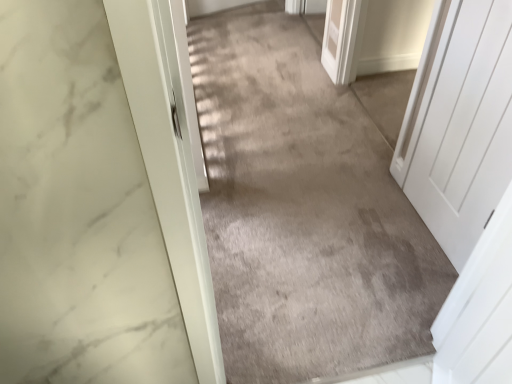
What are the coordinates of `gray carpet at center` in the screenshot? It's located at (306, 205).

What do you see at coordinates (306, 205) in the screenshot? This screenshot has width=512, height=384. I see `gray carpet at center` at bounding box center [306, 205].

What do you see at coordinates (465, 127) in the screenshot?
I see `white matte door at right` at bounding box center [465, 127].

This screenshot has width=512, height=384. I want to click on white matte door at right, so click(x=465, y=127).

This screenshot has width=512, height=384. Identify the location of gray carpet at center. (306, 205).

Is gray carpet at center to the right of white matte door at right from the viewer's perspective?

In fact, gray carpet at center is to the left of white matte door at right.

Is the position of gray carpet at center more distant than that of white matte door at right?

Yes, gray carpet at center is behind white matte door at right.

Does point (197, 74) come farther from viewer compared to point (487, 43)?

Yes, it is behind point (487, 43).

Consider the image. From the image's perspective, which one is positioned lower, gray carpet at center or white matte door at right?

white matte door at right.

From a real-world perspective, is gray carpet at center above or below white matte door at right?

From a real-world perspective, gray carpet at center is physically below white matte door at right.

Considering the sizes of objects gray carpet at center and white matte door at right in the image provided, who is thinner, gray carpet at center or white matte door at right?

white matte door at right.

Which of these two, gray carpet at center or white matte door at right, stands shorter?

Standing shorter between the two is gray carpet at center.

Between gray carpet at center and white matte door at right, which one has smaller size?

With smaller size is white matte door at right.

Can we say gray carpet at center lies outside white matte door at right?

Yes.

Are gray carpet at center and white matte door at right beside each other?

No, gray carpet at center is not beside white matte door at right.

Is gray carpet at center positioned with its back to white matte door at right?

gray carpet at center does not have its back to white matte door at right.

Where is `path behind the white matte door at right`? This screenshot has height=384, width=512. path behind the white matte door at right is located at coordinates (306, 205).

Is white matte door at right at the left side of gray carpet at center?

No, white matte door at right is not to the left of gray carpet at center.

Which object is closer to the camera taking this photo, white matte door at right or gray carpet at center?

white matte door at right.

In the scene shown: Which point is more distant from viewer, (434, 156) or (223, 59)?

The point (223, 59) is more distant.

From the image's perspective, is white matte door at right on top of gray carpet at center?

No, from the image's perspective, white matte door at right is not on top of gray carpet at center.

From a real-world perspective, who is located lower, white matte door at right or gray carpet at center?

In real-world perspective, gray carpet at center is lower.

Considering the relative sizes of white matte door at right and gray carpet at center in the image provided, is white matte door at right thinner than gray carpet at center?

Yes, white matte door at right is thinner than gray carpet at center.

Who is taller, white matte door at right or gray carpet at center?

With more height is white matte door at right.

Does white matte door at right have a smaller size compared to gray carpet at center?

Yes, white matte door at right is smaller than gray carpet at center.

Which is correct: white matte door at right is inside gray carpet at center, or outside of it?

white matte door at right is outside gray carpet at center.

Is the surface of white matte door at right in direct contact with gray carpet at center?

No, white matte door at right is not in contact with gray carpet at center.

Is white matte door at right looking in the opposite direction of gray carpet at center?

No, white matte door at right is not facing away from gray carpet at center.

How different are the orientations of white matte door at right and gray carpet at center in degrees?

There is a 89.5-degree angle between the facing directions of white matte door at right and gray carpet at center.

Looking at this image, how much distance is there between white matte door at right and gray carpet at center?

A distance of 19.94 inches exists between white matte door at right and gray carpet at center.

The image size is (512, 384). I want to click on path that is behind the white matte door at right, so click(306, 205).

You are a GUI agent. You are given a task and a screenshot of the screen. Output one action in this format:
    pyautogui.click(x=<x>, y=<y>)
    Task: Click on the door to the right of gray carpet at center
    This screenshot has width=512, height=384.
    Given the screenshot: What is the action you would take?
    pyautogui.click(x=465, y=127)

You are a GUI agent. You are given a task and a screenshot of the screen. Output one action in this format:
    pyautogui.click(x=<x>, y=<y>)
    Task: Click on the door above the gray carpet at center (from a real-world perspective)
    This screenshot has height=384, width=512.
    Given the screenshot: What is the action you would take?
    pyautogui.click(x=465, y=127)